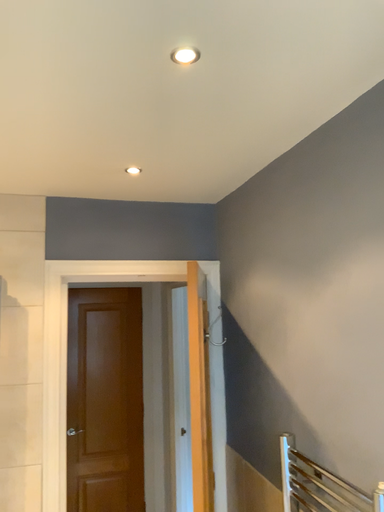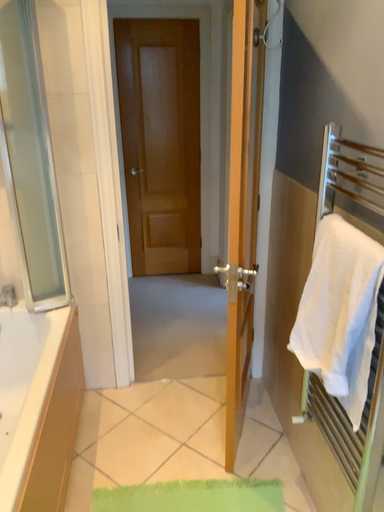
Question: How did the camera likely rotate when shooting the video?

Choices:
 (A) rotated downward
 (B) rotated upward

Answer: (A)